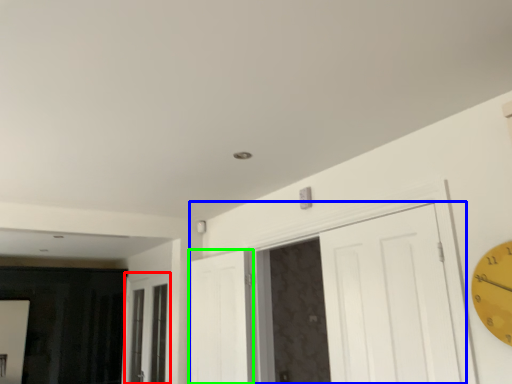
Question: Which is farther away from window (highlighted by a red box)? door (highlighted by a blue box) or door (highlighted by a green box)?

Choices:
 (A) door
 (B) door

Answer: (A)